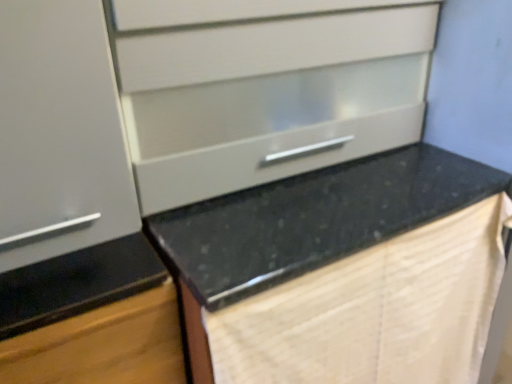
Question: Considering their positions, is beige textured blanket at lower right located in front of or behind matte white cabinet at left, the second cabinetry ordered from the bottom?

Choices:
 (A) front
 (B) behind

Answer: (B)

Question: Considering the positions of point (360, 292) and point (101, 213), is point (360, 292) closer or farther from the camera than point (101, 213)?

Choices:
 (A) farther
 (B) closer

Answer: (A)

Question: Which is farther from the black granite countertop at center?

Choices:
 (A) beige textured blanket at lower right
 (B) matte white drawer at upper center
 (C) matte black cabinet at left, the 2th cabinetry from the top
 (D) matte white cabinet at left, the second cabinetry ordered from the bottom

Answer: (D)

Question: Which object is positioned closest to the matte black cabinet at left, the 2th cabinetry from the top?

Choices:
 (A) black granite countertop at center
 (B) matte white drawer at upper center
 (C) matte white cabinet at left, arranged as the 1th cabinetry when viewed from the top
 (D) beige textured blanket at lower right

Answer: (C)